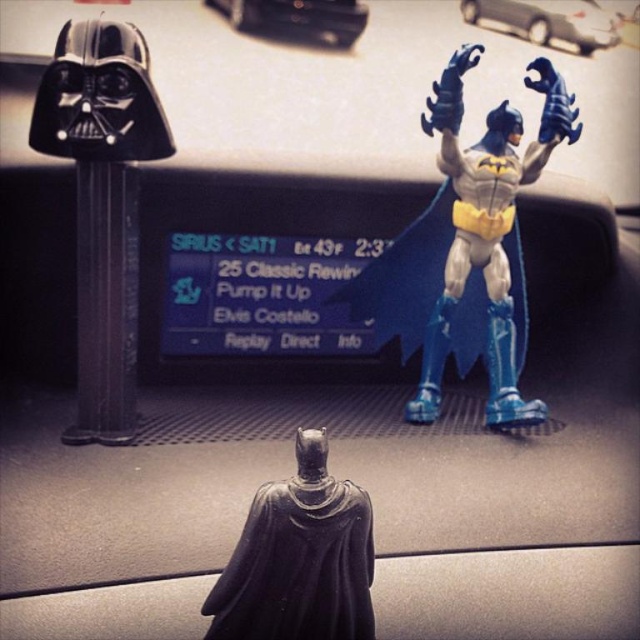
Does blue plastic batman figure at upper right have a greater height compared to black matte darth vader head at left?

Yes, blue plastic batman figure at upper right is taller than black matte darth vader head at left.

Which is behind, point (442, 314) or point (115, 20)?

The point (442, 314) is more distant.

Is point (403, 305) less distant than point (90, 356)?

No, (403, 305) is further to viewer.

Find the location of a particular element. The image size is (640, 640). blue plastic batman figure at upper right is located at coordinates [x=467, y=250].

Which is below, black matte darth vader head at left or black glossy statue at center?

black glossy statue at center

Is point (113, 77) positioned after point (304, 580)?

Yes.

Find the location of a particular element. The image size is (640, 640). black matte darth vader head at left is located at coordinates (102, 204).

Does blue plastic batman figure at upper right appear over black glossy statue at center?

Yes.

Is point (406, 339) closer to viewer compared to point (301, 452)?

No, it is not.

Is point (452, 282) positioned behind point (348, 636)?

Yes, it is behind point (348, 636).

At what (x,y) coordinates should I click in order to perform the action: click on blue plastic batman figure at upper right. Please return your answer as a coordinate pair (x, y). Looking at the image, I should click on (467, 250).